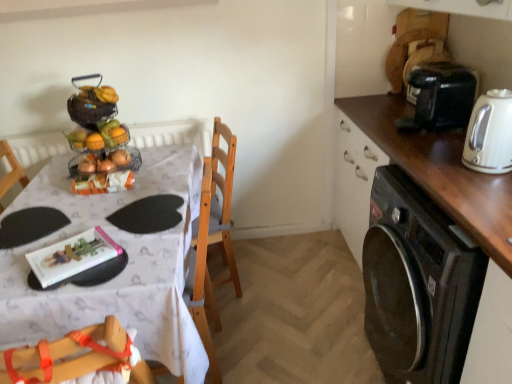
In order to click on free point to the right of white glossy table at upper left in this screenshot , I will do `click(298, 304)`.